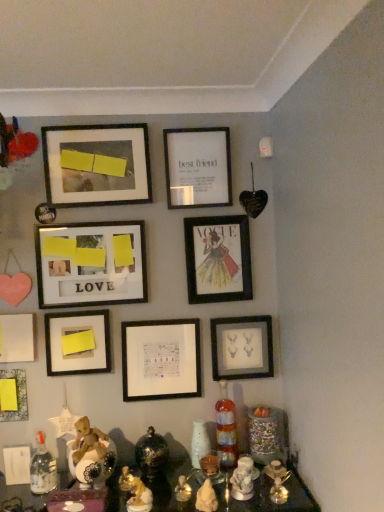
Question: Visually, is translucent glass bottle at lower right, the second bottle viewed from the left, positioned to the left or to the right of yellow matte paper at lower left, acting as the sixth picture frame starting from the top?

Choices:
 (A) left
 (B) right

Answer: (B)

Question: From a real-world perspective, is translucent glass bottle at lower right, the 2th bottle positioned from the front, above or below yellow matte paper at lower left, positioned as the fourth picture frame in bottom-to-top order?

Choices:
 (A) above
 (B) below

Answer: (B)

Question: Estimate the real-world distances between objects in this image. Which object is farther from the matte black picture frame at center, the second picture frame when ordered from bottom to top?

Choices:
 (A) yellow matte paper at lower left, acting as the sixth picture frame starting from the top
 (B) translucent glass bottle at lower left, the 1th bottle positioned from the front
 (C) matte yellow paper at lower left, which appears as the 9th picture frame when viewed from the top
 (D) white matte picture frame at upper center, the first picture frame viewed from the top
 (E) translucent glass candle holder at center

Answer: (D)

Question: Which of these objects is positioned farthest from the matte yellow paper at lower left, which appears as the 1th picture frame when ordered from the bottom?

Choices:
 (A) matte black frame at center-right, which is the third picture frame from bottom to top
 (B) matte black frame at upper left, marked as the eighth picture frame in a bottom-to-top arrangement
 (C) matte wooden picture frame at center-left, which ranks as the 4th picture frame in top-to-bottom order
 (D) translucent glass bottle at lower left, placed as the second bottle when sorted from right to left
 (E) matte black picture frame at center, the seventh picture frame when ordered from bottom to top

Answer: (E)